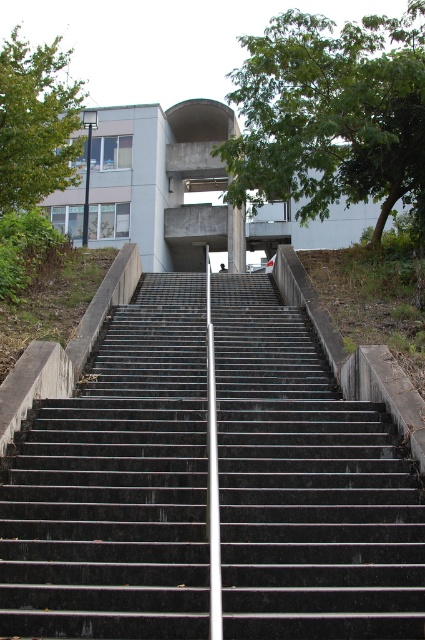
You are standing at point (116, 484) and want to walk up the stairs. Are the black concrete stairs at center visible from your current position?

Yes, the black concrete stairs at center are located exactly at your current position at point (116, 484), so they are directly under your feet and visible.

Consider the image. You are standing at the bottom of the black concrete stairs at center and want to reach the green leafy tree at upper center. Which direction should you move towards?

The black concrete stairs at center is to the left of the green leafy tree at upper center, so you should move to the right to reach the tree.

You are standing at the base of the black concrete stairs at center. To reach the curved architectural feature at the top, in which direction should you move relative to your current position?

Since the black concrete stairs at center lead upwards towards the curved architectural feature at the top, you should move forward along the stairs to reach it.